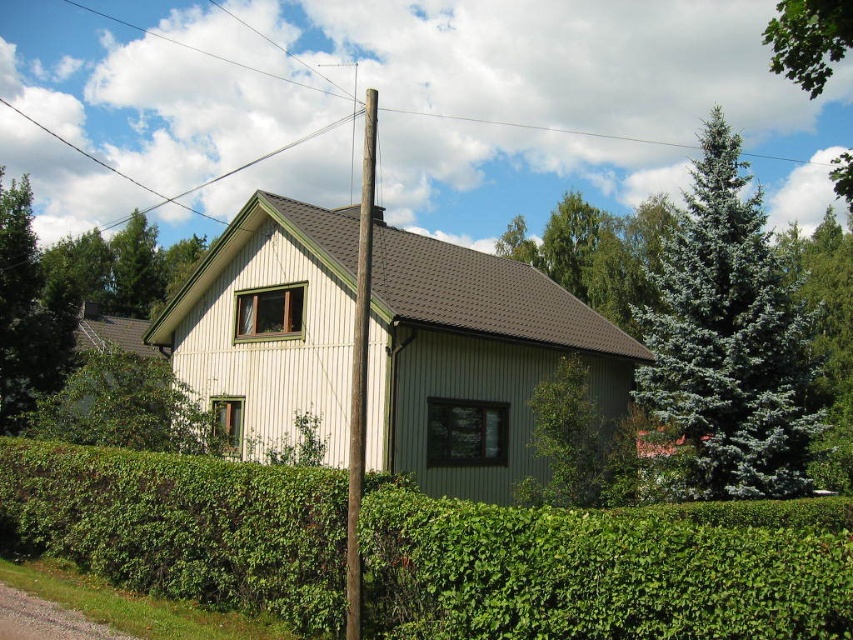
You are standing in front of the house and see the green leafy tree at upper left and the brown wooden telegraph pole at center. Which object is positioned more to the left side?

The green leafy tree at upper left is positioned more to the left side than the brown wooden telegraph pole at center.

Looking at this image, you are standing in front of the house and want to determine which of the two points, point (62, 388) or point (148, 308), is closer to you. Based on the scene description, which point is nearer?

Point (62, 388) is closer to the camera than point (148, 308), so it is the nearer one.